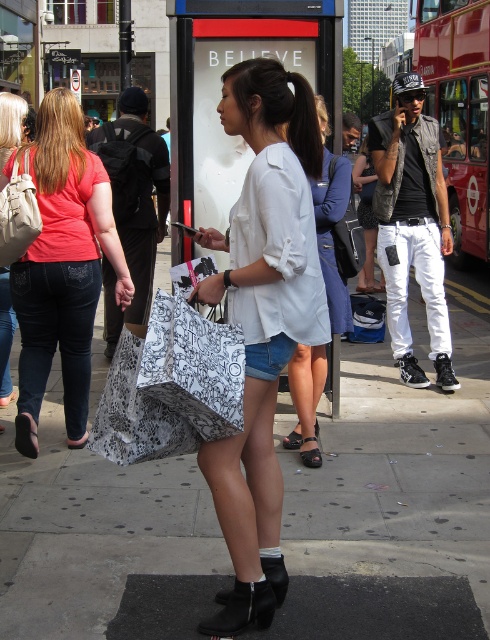
Is white printed paper bag at center taller than matte beige handbag at left?

In fact, white printed paper bag at center may be shorter than matte beige handbag at left.

Is point (243, 344) farther from camera compared to point (28, 148)?

No, (243, 344) is in front of (28, 148).

Locate an element on the screen. white printed paper bag at center is located at coordinates (194, 365).

Does matte beige handbag at left appear on the right side of black hair at center?

In fact, matte beige handbag at left is to the left of black hair at center.

Measure the distance between point (21, 147) and camera.

They are 4.28 meters apart.

Where is `matte beige handbag at left`? matte beige handbag at left is located at coordinates (18, 212).

Looking at this image, is denim jeans at center behind light blue denim shorts at center?

No, it is in front of light blue denim shorts at center.

Is denim jeans at center to the right of light blue denim shorts at center from the viewer's perspective?

Incorrect, denim jeans at center is not on the right side of light blue denim shorts at center.

You are a GUI agent. You are given a task and a screenshot of the screen. Output one action in this format:
    pyautogui.click(x=<x>, y=<y>)
    Task: Click on the denim jeans at center
    This screenshot has width=490, height=640.
    Given the screenshot: What is the action you would take?
    pyautogui.click(x=65, y=262)

Where is `denim jeans at center`? The image size is (490, 640). denim jeans at center is located at coordinates (65, 262).